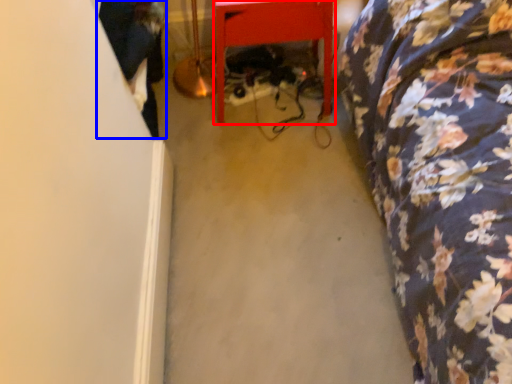
Question: Which point is closer to the camera, furniture (highlighted by a red box) or couple (highlighted by a blue box)?

Choices:
 (A) furniture
 (B) couple

Answer: (A)